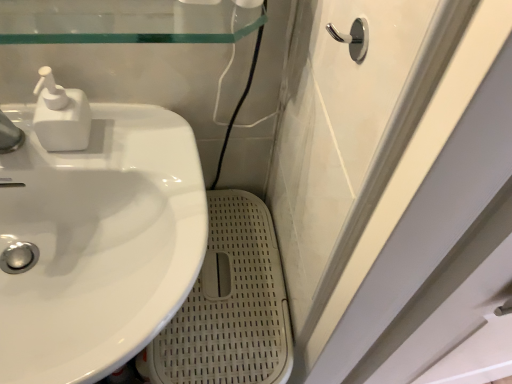
Question: Considering the positions of point (44, 134) and point (138, 251), is point (44, 134) closer or farther from the camera than point (138, 251)?

Choices:
 (A) closer
 (B) farther

Answer: (A)

Question: Considering the positions of white matte soap dispenser at upper left and white glossy sink at left in the image, is white matte soap dispenser at upper left wider or thinner than white glossy sink at left?

Choices:
 (A) thin
 (B) wide

Answer: (A)

Question: Considering the real-world distances, which object is closest to the white glossy sink at left?

Choices:
 (A) white matte soap dispenser at upper left
 (B) polished chrome hook at upper right

Answer: (A)

Question: Estimate the real-world distances between objects in this image. Which object is farther from the white glossy sink at left?

Choices:
 (A) polished chrome hook at upper right
 (B) white matte soap dispenser at upper left

Answer: (A)